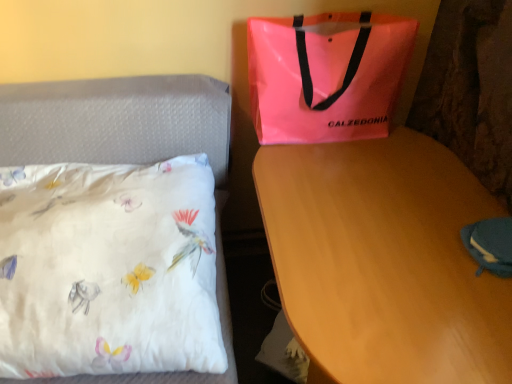
Question: Is white satin pillow at left to the right of blue fabric pouch at lower right from the viewer's perspective?

Choices:
 (A) yes
 (B) no

Answer: (B)

Question: From the image's perspective, is white satin pillow at left above blue fabric pouch at lower right?

Choices:
 (A) yes
 (B) no

Answer: (B)

Question: Is blue fabric pouch at lower right at the back of white satin pillow at left?

Choices:
 (A) yes
 (B) no

Answer: (B)

Question: Considering the relative positions of white satin pillow at left and blue fabric pouch at lower right in the image provided, is white satin pillow at left in front of blue fabric pouch at lower right?

Choices:
 (A) no
 (B) yes

Answer: (B)

Question: Considering the relative sizes of white satin pillow at left and blue fabric pouch at lower right in the image provided, is white satin pillow at left wider than blue fabric pouch at lower right?

Choices:
 (A) no
 (B) yes

Answer: (B)

Question: Considering the positions of point (159, 81) and point (505, 271), is point (159, 81) closer or farther from the camera than point (505, 271)?

Choices:
 (A) closer
 (B) farther

Answer: (B)

Question: From a real-world perspective, is white satin pillow at left positioned above or below blue fabric pouch at lower right?

Choices:
 (A) below
 (B) above

Answer: (A)

Question: Considering the relative positions of white satin pillow at left and blue fabric pouch at lower right in the image provided, is white satin pillow at left to the left or to the right of blue fabric pouch at lower right?

Choices:
 (A) left
 (B) right

Answer: (A)

Question: Do you think white satin pillow at left is within blue fabric pouch at lower right, or outside of it?

Choices:
 (A) outside
 (B) inside

Answer: (A)

Question: Is blue fabric pouch at lower right situated inside white satin pillow at left or outside?

Choices:
 (A) inside
 (B) outside

Answer: (B)

Question: From their relative heights in the image, would you say blue fabric pouch at lower right is taller or shorter than white satin pillow at left?

Choices:
 (A) tall
 (B) short

Answer: (B)

Question: In terms of width, does blue fabric pouch at lower right look wider or thinner when compared to white satin pillow at left?

Choices:
 (A) thin
 (B) wide

Answer: (A)

Question: From the image's perspective, is blue fabric pouch at lower right positioned above or below white satin pillow at left?

Choices:
 (A) below
 (B) above

Answer: (B)

Question: From a real-world perspective, is neon pink plastic bag at upper right positioned above or below white satin pillow at left?

Choices:
 (A) below
 (B) above

Answer: (B)

Question: Relative to white satin pillow at left, is neon pink plastic bag at upper right in front or behind?

Choices:
 (A) front
 (B) behind

Answer: (B)